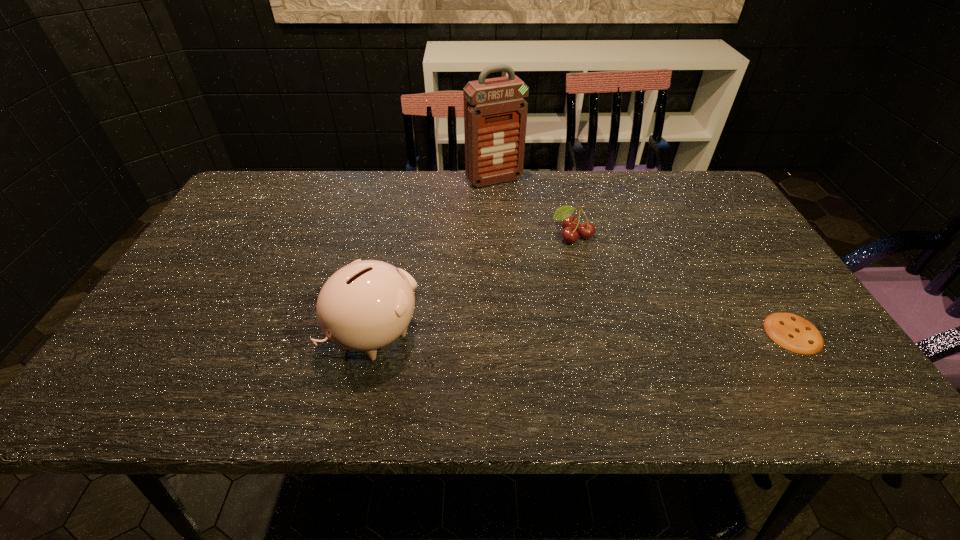
At what (x,y) coordinates should I click in order to perform the action: click on blank region between the leftmost object and the farthest object. Please return your answer as a coordinate pair (x, y). This screenshot has height=540, width=960. Looking at the image, I should click on (435, 256).

You are a GUI agent. You are given a task and a screenshot of the screen. Output one action in this format:
    pyautogui.click(x=<x>, y=<y>)
    Task: Click on the free area in between the tallest object and the rightmost object
    This screenshot has height=540, width=960.
    Given the screenshot: What is the action you would take?
    pyautogui.click(x=643, y=256)

In order to click on empty space between the cherry and the rightmost object in this screenshot , I will do `click(683, 285)`.

Where is `free space between the cookie and the third tallest object`? free space between the cookie and the third tallest object is located at coordinates (683, 285).

The image size is (960, 540). What are the coordinates of `vacant area that lies between the rightmost object and the third shortest object` in the screenshot? It's located at (584, 333).

At what (x,y) coordinates should I click in order to perform the action: click on free space that is in between the shortest object and the leftmost object. Please return your answer as a coordinate pair (x, y). Looking at the image, I should click on (584, 333).

Image resolution: width=960 pixels, height=540 pixels. What are the coordinates of `vacant space in between the third shortest object and the tallest object` in the screenshot? It's located at (435, 256).

Identify which object is located as the second nearest to the third shortest object. Please provide its 2D coordinates. Your answer should be formatted as a tuple, i.e. [(x, y)], where the tuple contains the x and y coordinates of a point satisfying the conditions above.

[(495, 112)]

Locate an element on the screen. The image size is (960, 540). object identified as the closest to the shortest object is located at coordinates (585, 230).

This screenshot has width=960, height=540. In order to click on free space in the image that satisfies the following two spatial constraints: 1. on the back side of the piggy bank; 2. on the right side of the third object from left to right in this screenshot , I will do `click(396, 236)`.